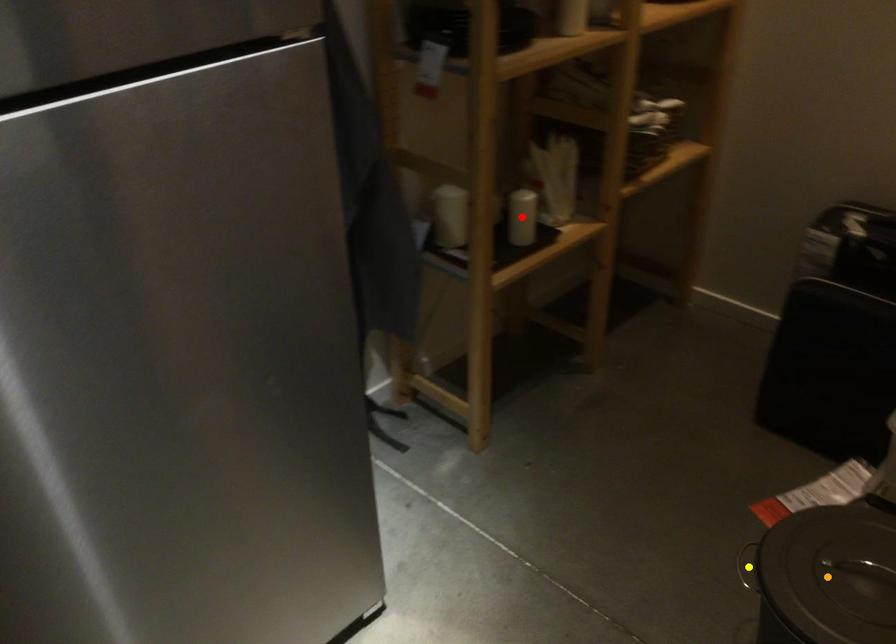
From the picture: Order these from nearest to farthest:
1. yellow point
2. orange point
3. red point

orange point, yellow point, red point